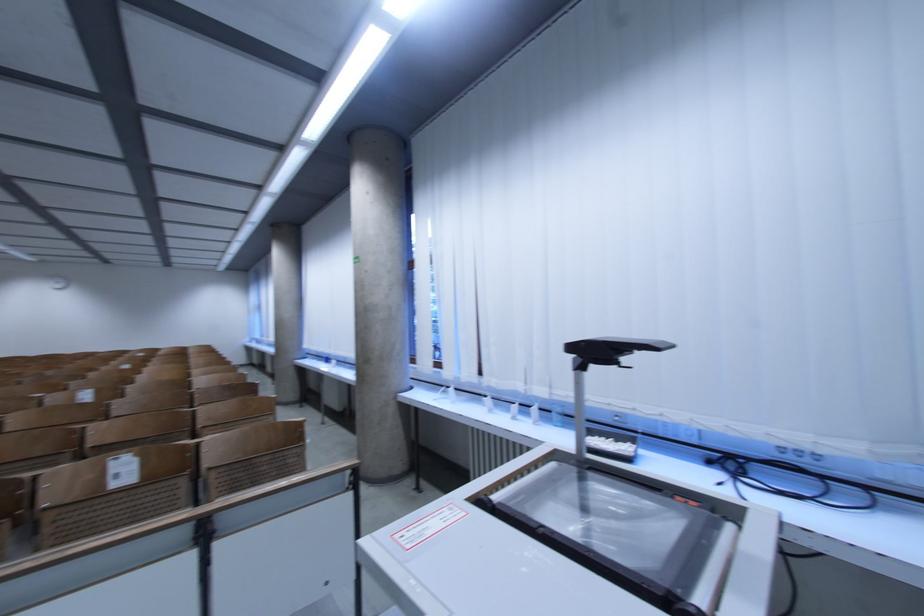
Describe the element at coordinates (601, 369) in the screenshot. I see `a projector head` at that location.